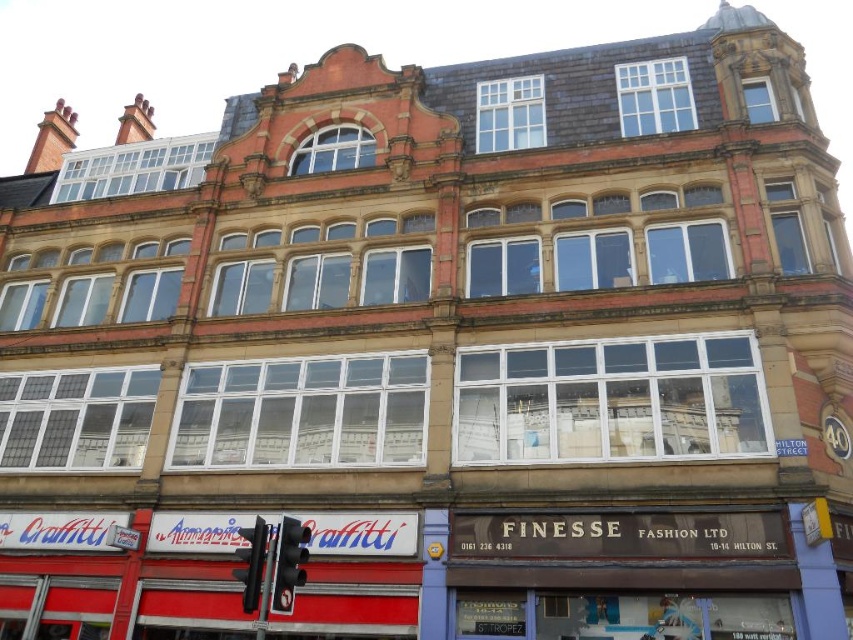
You are standing in front of the Victorian building and notice two points marked on the facade. The first point is at coordinate point(287, 582) and the second at point(258, 586). From your perspective, which point is closer to you?

Point point(287, 582) is in front of point point(258, 586), so it is closer to you.